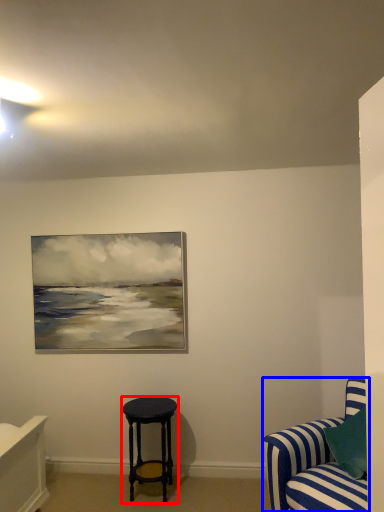
Question: Which object is further to the camera taking this photo, stool (highlighted by a red box) or studio couch (highlighted by a blue box)?

Choices:
 (A) stool
 (B) studio couch

Answer: (A)